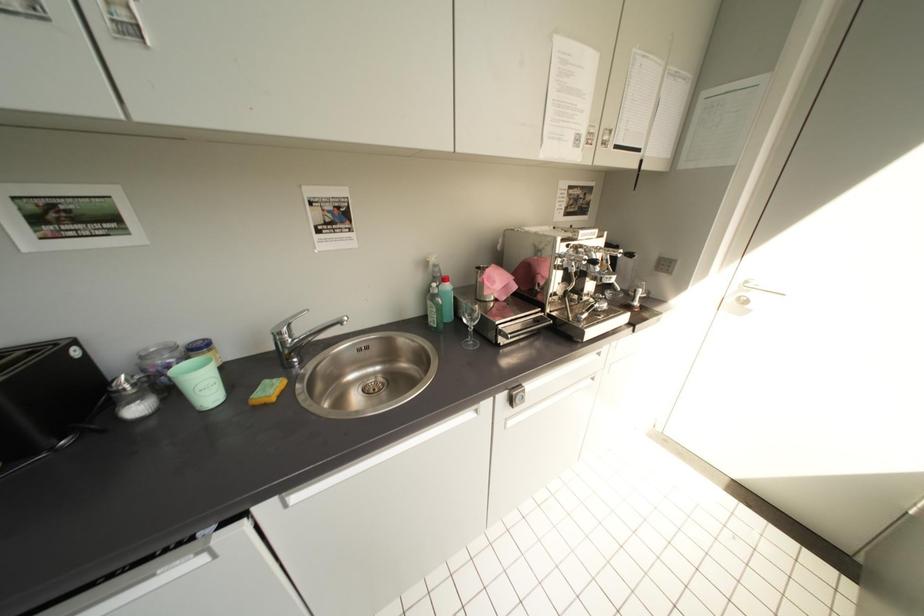
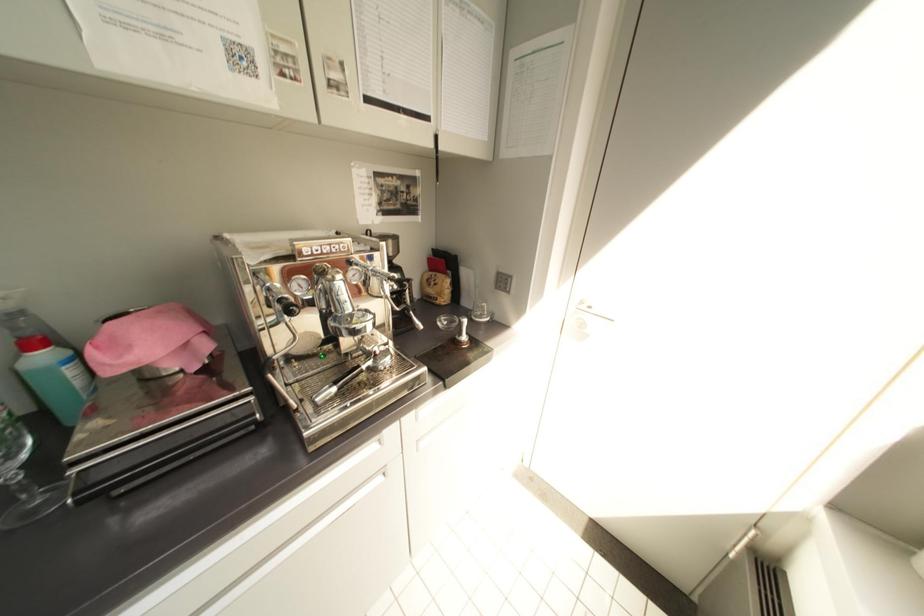
Question: The images are taken continuously from a first-person perspective. In which direction is your viewpoint rotating?

Choices:
 (A) Left
 (B) Right
 (C) Up
 (D) Down

Answer: (B)